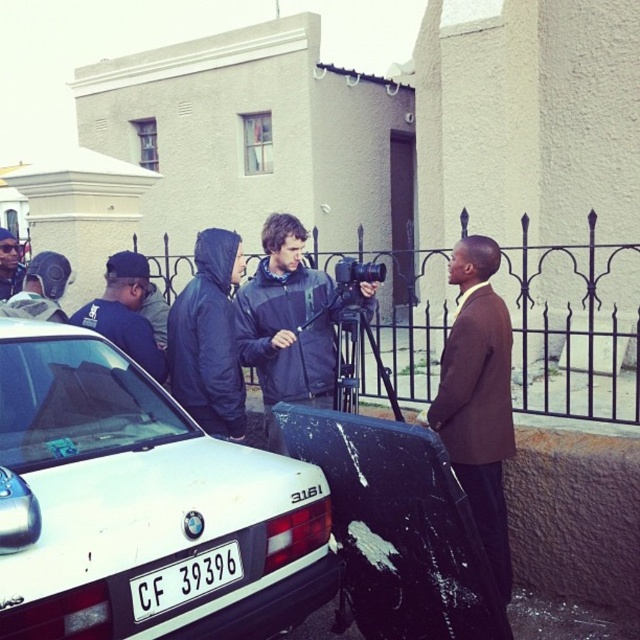
Is dark blue hoodie at left wider than matte black helmet at left?

Correct, the width of dark blue hoodie at left exceeds that of matte black helmet at left.

Is the position of dark blue hoodie at left more distant than that of matte black helmet at left?

No, dark blue hoodie at left is in front of matte black helmet at left.

What do you see at coordinates (125, 312) in the screenshot?
I see `dark blue hoodie at left` at bounding box center [125, 312].

Locate an element on the screen. The height and width of the screenshot is (640, 640). dark blue hoodie at left is located at coordinates (125, 312).

Can you confirm if white matte car at lower left is smaller than white plastic license plate at lower center?

No.

Does white matte car at lower left have a greater width compared to white plastic license plate at lower center?

Yes, white matte car at lower left is wider than white plastic license plate at lower center.

At what (x,y) coordinates should I click in order to perform the action: click on white matte car at lower left. Please return your answer as a coordinate pair (x, y). Looking at the image, I should click on (145, 506).

Where is `white matte car at lower left`? The width and height of the screenshot is (640, 640). white matte car at lower left is located at coordinates (145, 506).

Which is above, white matte car at lower left or matte black helmet at left?

matte black helmet at left is higher up.

Who is lower down, white matte car at lower left or matte black helmet at left?

white matte car at lower left is below.

Locate an element on the screen. This screenshot has height=640, width=640. white matte car at lower left is located at coordinates (145, 506).

Find the location of a particular element. This screenshot has height=640, width=640. white matte car at lower left is located at coordinates (145, 506).